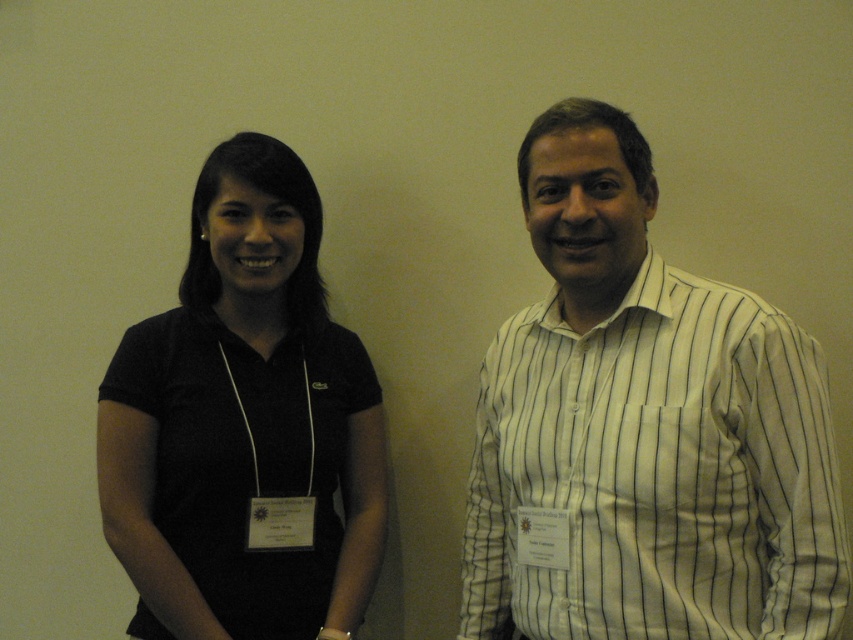
You are standing in front of the image and want to identify the position of the white striped shirt at right. According to the coordinates provided, where exactly is it located?

The white striped shirt at right is located at point coordinates (643, 429).

You are organizing a clothing donation drive and need to categorize shirts by size. You have two shirts to sort today. The first is a black fabric shirt at left, and the second is a white striped shirt at right. Which shirt has a larger width and should be placed in the larger size bin?

The white striped shirt at right has a larger width than the black fabric shirt at left, so it should be placed in the larger size bin.

You are standing 5 feet away from the wall where the two people are standing. There is a specific point at coordinates point (700, 552). Can you reach this point with your hand if you extend it fully?

The distance of point (700, 552) from viewer is 3.86 feet, so yes, you can reach it with your hand since 3.86 feet is less than 5 feet.